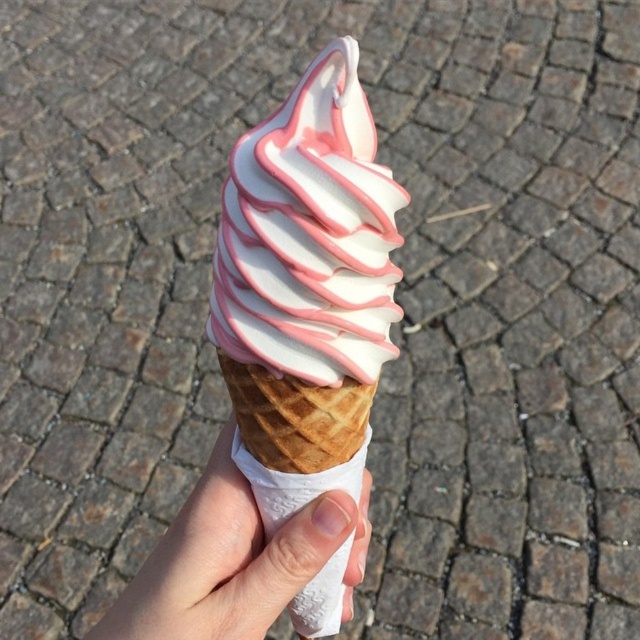
Does pink matte ice cream cone at center have a larger size compared to white paper at center?

Correct, pink matte ice cream cone at center is larger in size than white paper at center.

Is point (301, 461) in front of point (189, 504)?

Yes, point (301, 461) is closer to viewer.

Is point (332, 380) positioned before point (365, 477)?

Yes, point (332, 380) is in front of point (365, 477).

Identify the location of pink matte ice cream cone at center. (305, 288).